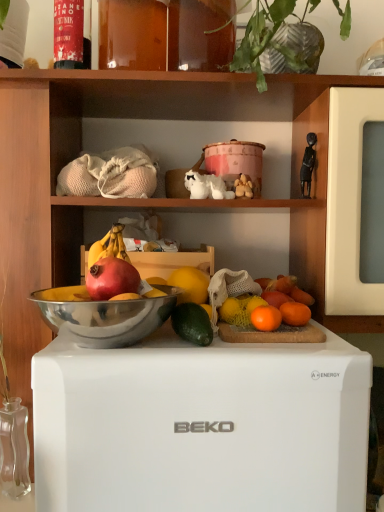
Question: In the image, is red matte grapefruit at center, placed as the first grapefruit when sorted from left to right, on the left side or the right side of orange matte grapefruit at upper right, which is counted as the 2th grapefruit, starting from the front?

Choices:
 (A) left
 (B) right

Answer: (A)

Question: Is red matte grapefruit at center, placed as the first grapefruit when sorted from left to right, taller or shorter than orange matte grapefruit at upper right, the 2th grapefruit in the right-to-left sequence?

Choices:
 (A) short
 (B) tall

Answer: (B)

Question: Which of these objects is positioned closest to the orange matte at center?

Choices:
 (A) orange matte grapefruit at right, which ranks as the 1th grapefruit in back-to-front order
 (B) white matte refrigerator at center
 (C) white ceramic dog at center
 (D) black matte figurine at upper right, which ranks as the first toy in right-to-left order
 (E) metallic silver bowl at center

Answer: (A)

Question: Which object is positioned closest to the green leafy plant at upper center?

Choices:
 (A) black matte figurine at upper right, which ranks as the second toy in left-to-right order
 (B) white matte refrigerator at center
 (C) green matte avocado at center
 (D) orange matte grapefruit at right, the 3th grapefruit from the left
 (E) metallic silver bowl at center

Answer: (A)